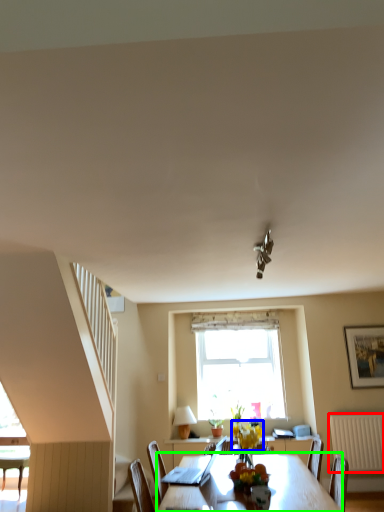
Question: Based on their relative distances, which object is nearer to radiator (highlighted by a red box)? Choose from flower (highlighted by a blue box) and table (highlighted by a green box).

Choices:
 (A) flower
 (B) table

Answer: (A)